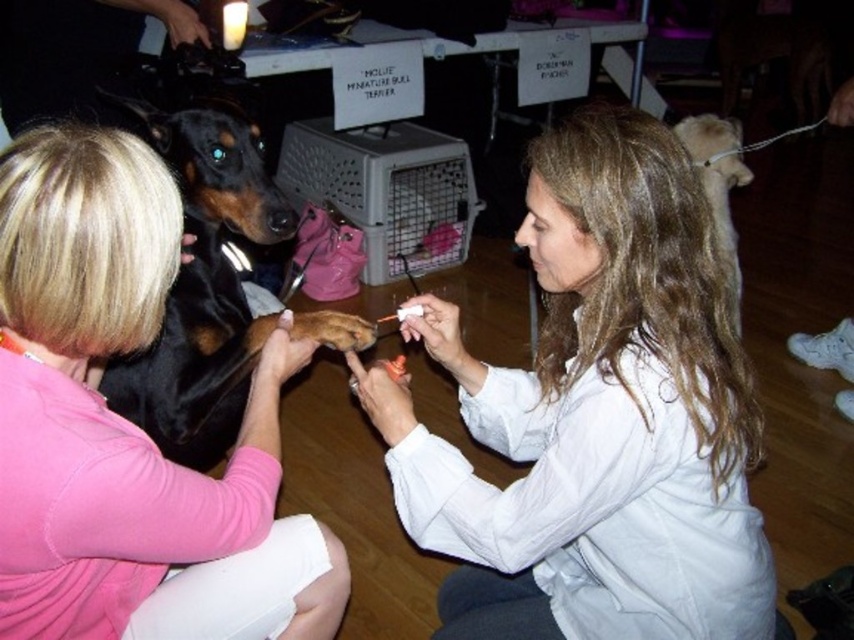
You are a photographer at the event and need to ensure both the smooth white coat at center and the black shiny fur at center are visible in your photo. Given their sizes, which one should you focus on to capture both effectively?

The smooth white coat at center is bigger than the black shiny fur at center, so focusing on the larger smooth white coat at center while ensuring the smaller black shiny fur at center is within the frame will help capture both effectively.